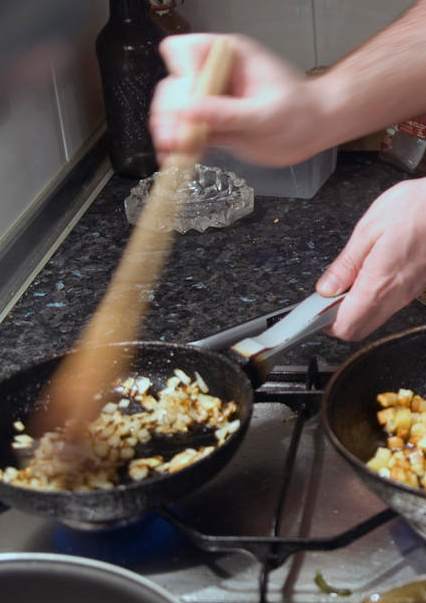
Where is `granite countertop`? This screenshot has width=426, height=603. granite countertop is located at coordinates (48, 302), (243, 270), (351, 197).